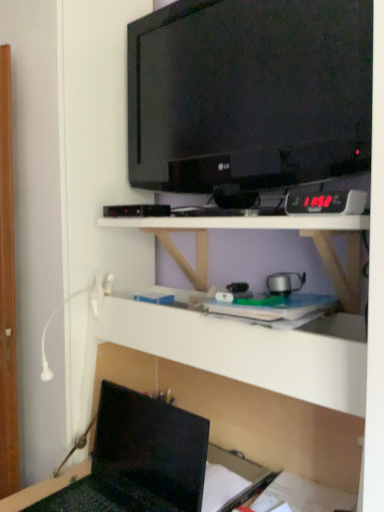
Question: Considering the relative positions of black glossy tv at upper center and matte black laptop at lower left in the image provided, is black glossy tv at upper center to the right of matte black laptop at lower left from the viewer's perspective?

Choices:
 (A) yes
 (B) no

Answer: (A)

Question: Does black glossy tv at upper center have a greater width compared to matte black laptop at lower left?

Choices:
 (A) yes
 (B) no

Answer: (B)

Question: Is black glossy tv at upper center oriented away from matte black laptop at lower left?

Choices:
 (A) no
 (B) yes

Answer: (A)

Question: Can matte black laptop at lower left be found inside black glossy tv at upper center?

Choices:
 (A) no
 (B) yes

Answer: (A)

Question: From the image's perspective, does black glossy tv at upper center appear lower than matte black laptop at lower left?

Choices:
 (A) no
 (B) yes

Answer: (A)

Question: Is matte black laptop at lower left in front of or behind white matte shelf at center, the second shelf positioned from the bottom, in the image?

Choices:
 (A) front
 (B) behind

Answer: (B)

Question: In terms of width, does matte black laptop at lower left look wider or thinner when compared to white matte shelf at center, the second shelf positioned from the bottom?

Choices:
 (A) thin
 (B) wide

Answer: (A)

Question: Do you think matte black laptop at lower left is within white matte shelf at center, the second shelf positioned from the bottom, or outside of it?

Choices:
 (A) outside
 (B) inside

Answer: (A)

Question: From their relative heights in the image, would you say matte black laptop at lower left is taller or shorter than white matte shelf at center, the second shelf positioned from the bottom?

Choices:
 (A) tall
 (B) short

Answer: (A)

Question: Is black glossy tv at upper center bigger or smaller than white matte shelf at center, arranged as the 2th shelf when viewed from the top?

Choices:
 (A) small
 (B) big

Answer: (A)

Question: Considering the positions of black glossy tv at upper center and white matte shelf at center, arranged as the 2th shelf when viewed from the top, in the image, is black glossy tv at upper center taller or shorter than white matte shelf at center, arranged as the 2th shelf when viewed from the top,?

Choices:
 (A) tall
 (B) short

Answer: (B)

Question: Relative to white matte shelf at center, the first shelf positioned from the bottom, is black glossy tv at upper center in front or behind?

Choices:
 (A) behind
 (B) front

Answer: (A)

Question: Is point (142, 30) positioned closer to the camera than point (145, 373)?

Choices:
 (A) closer
 (B) farther

Answer: (A)

Question: From a real-world perspective, is matte black laptop at lower left positioned above or below black glossy tv at upper center?

Choices:
 (A) above
 (B) below

Answer: (B)

Question: Considering the positions of matte black laptop at lower left and black glossy tv at upper center in the image, is matte black laptop at lower left wider or thinner than black glossy tv at upper center?

Choices:
 (A) wide
 (B) thin

Answer: (A)